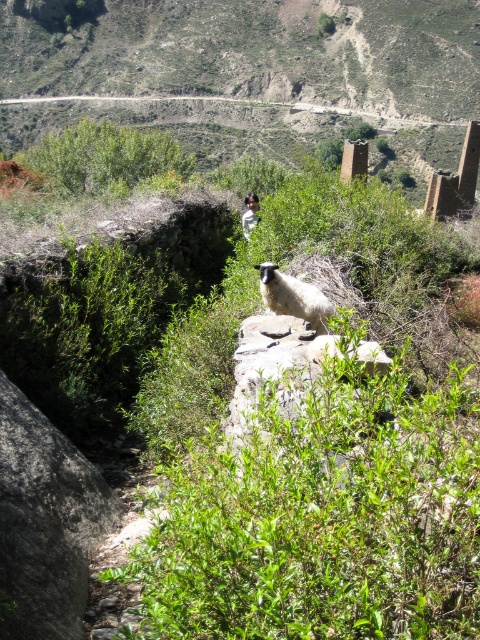
Find the location of a particular element. Image resolution: width=480 pixels, height=640 pixels. green leafy bush at upper center is located at coordinates (105, 157).

Is the position of green leafy bush at upper center less distant than that of white woolly sheep at center?

No.

Where is `green leafy bush at upper center`? The height and width of the screenshot is (640, 480). green leafy bush at upper center is located at coordinates (105, 157).

Where is `green leafy bush at upper center`? The width and height of the screenshot is (480, 640). green leafy bush at upper center is located at coordinates (105, 157).

Is green leafy shrub at center above green leafy bush at upper center?

Incorrect, green leafy shrub at center is not positioned above green leafy bush at upper center.

Is green leafy shrub at center smaller than green leafy bush at upper center?

Indeed, green leafy shrub at center has a smaller size compared to green leafy bush at upper center.

In the scene shown: Measure the distance between point (325, 444) and camera.

Point (325, 444) is 7.02 meters from camera.

Where is `green leafy shrub at center`? green leafy shrub at center is located at coordinates (322, 515).

Which of these two, green leafy shrub at center or white woolly sheep at center, stands shorter?

white woolly sheep at center is shorter.

Who is more forward, (151,624) or (279,275)?

Point (151,624)

The height and width of the screenshot is (640, 480). In order to click on green leafy shrub at center in this screenshot , I will do `click(322, 515)`.